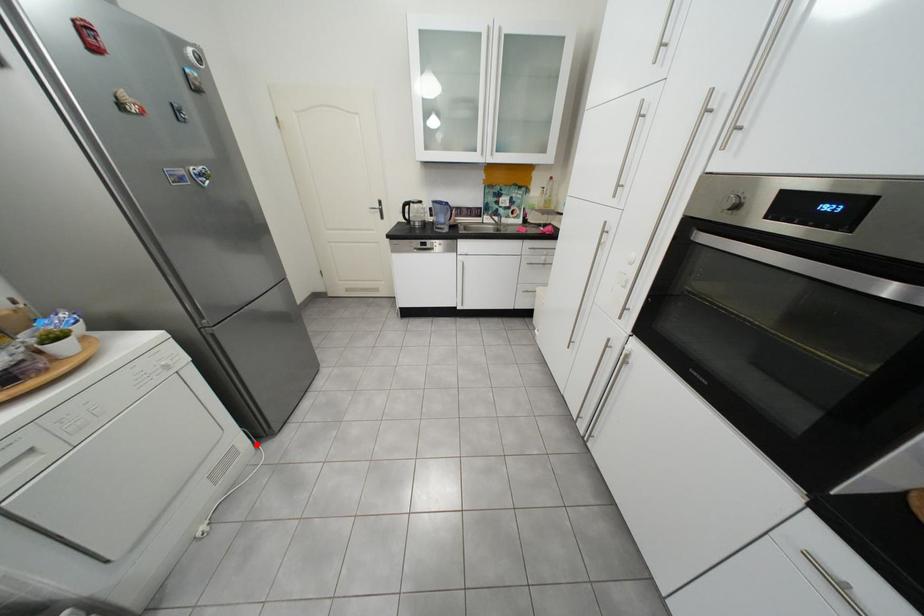
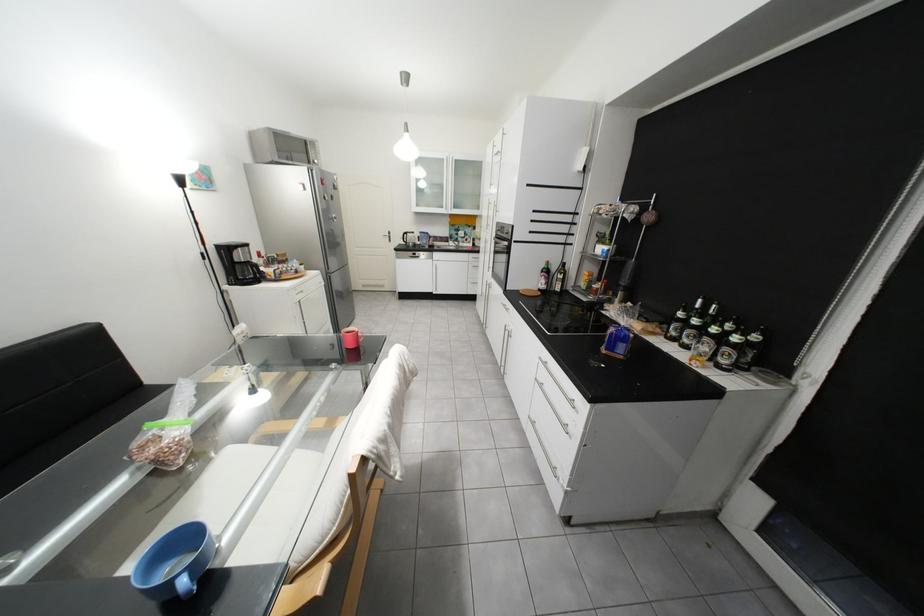
Where in the second image is the point corresponding to the highlighted location from the first image?

(343, 331)